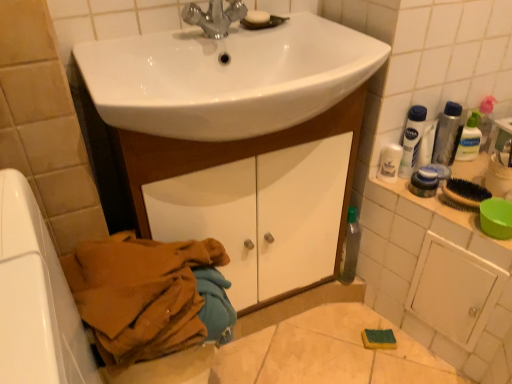
Where is `vacant space in front of white glossy mouthwash at upper right, arranged as the 1th mouthwash when viewed from the left`? The width and height of the screenshot is (512, 384). vacant space in front of white glossy mouthwash at upper right, arranged as the 1th mouthwash when viewed from the left is located at coordinates (429, 208).